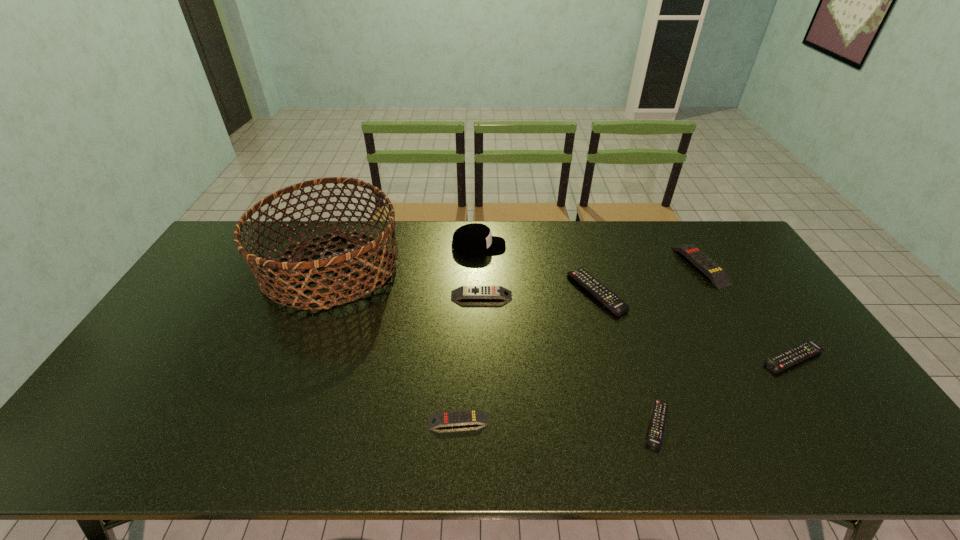
Locate an element on the screen. The image size is (960, 540). free region at the far right corner is located at coordinates (732, 247).

Identify the location of blank region between the shortest object and the sixth shortest object. The width and height of the screenshot is (960, 540). (678, 345).

This screenshot has height=540, width=960. What are the coordinates of `free area in between the black cap and the second biggest yellow remote control` in the screenshot? It's located at (480, 271).

The image size is (960, 540). I want to click on free space that is in between the biggest black remote control and the leftmost object, so click(464, 280).

Image resolution: width=960 pixels, height=540 pixels. What are the coordinates of `vacant area between the shortest object and the tallest object` in the screenshot? It's located at (494, 345).

This screenshot has width=960, height=540. Identify the location of free area in between the nearest black remote control and the smallest yellow remote control. (558, 423).

I want to click on free spot between the nearest black remote control and the black cap, so click(x=567, y=335).

At what (x,y) coordinates should I click in order to perform the action: click on empty location between the black cap and the tallest remote control. Please return your answer as a coordinate pair (x, y). The width and height of the screenshot is (960, 540). Looking at the image, I should click on (589, 256).

This screenshot has width=960, height=540. What are the coordinates of `empty space that is in between the second biggest black remote control and the farthest black remote control` in the screenshot? It's located at (695, 326).

You are a GUI agent. You are given a task and a screenshot of the screen. Output one action in this format:
    pyautogui.click(x=<x>, y=<y>)
    Task: Click on the unoccupied area between the farthest black remote control and the second tallest object
    The image size is (960, 540).
    Given the screenshot: What is the action you would take?
    pyautogui.click(x=538, y=269)